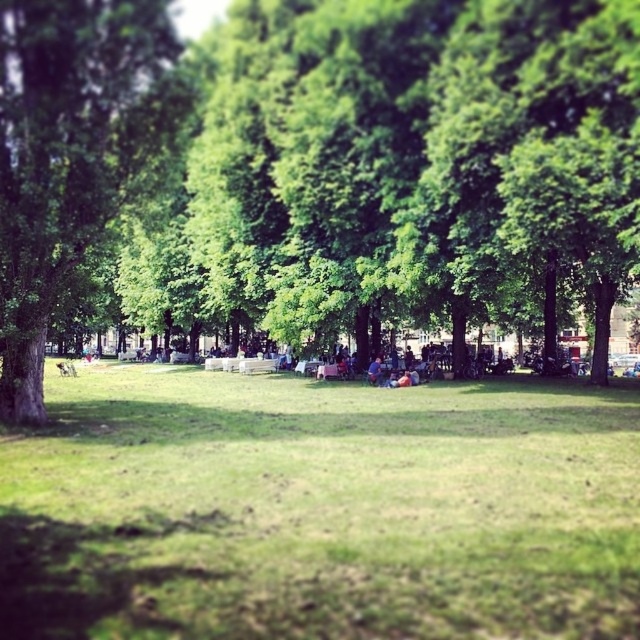
Which is behind, point (474, 29) or point (276, 525)?

The point (474, 29) is more distant.

Which is in front, point (369, 172) or point (637, 449)?

Positioned in front is point (637, 449).

The image size is (640, 640). What are the coordinates of `green leafy tree at center` in the screenshot? It's located at (324, 170).

Can you confirm if green leafy tree at left is bigger than white plastic bench at center?

No.

Who is shorter, green leafy tree at left or white plastic bench at center?

With less height is green leafy tree at left.

Does point (16, 84) come closer to viewer compared to point (250, 358)?

That is True.

At what (x,y) coordinates should I click in order to perform the action: click on green leafy tree at left. Please return your answer as a coordinate pair (x, y). This screenshot has height=640, width=640. Looking at the image, I should click on (68, 154).

Is point (444, 202) positioned in front of point (42, 358)?

No.

The height and width of the screenshot is (640, 640). What are the coordinates of `green leafy tree at center` in the screenshot? It's located at (324, 170).

Who is more forward, (x=49, y=64) or (x=118, y=84)?

Point (x=49, y=64)

The height and width of the screenshot is (640, 640). What are the coordinates of `green leafy tree at center` in the screenshot? It's located at (324, 170).